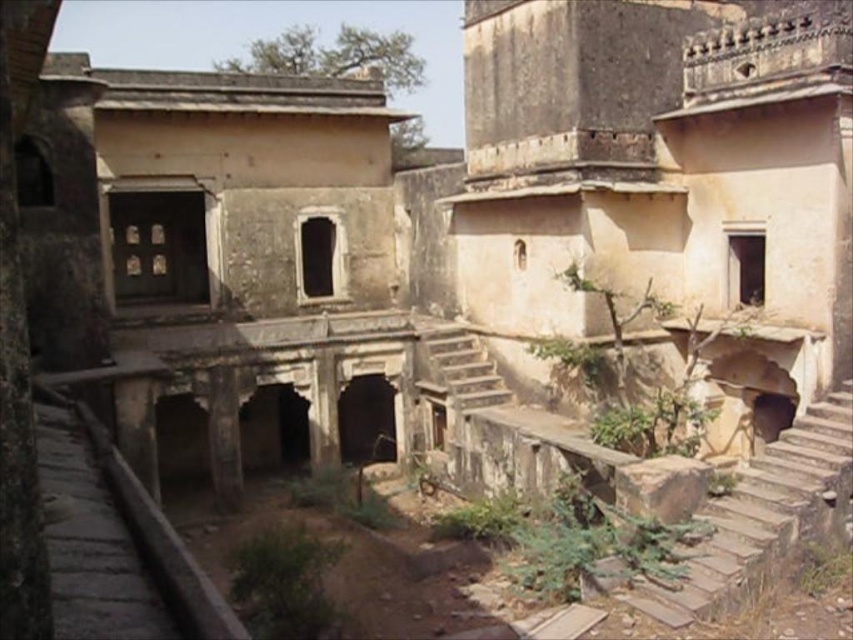
Which is in front, point (741, 520) or point (479, 394)?

Point (741, 520) is in front.

Does rustic stone stairs at lower right appear on the right side of rustic stone stairs at center?

Indeed, rustic stone stairs at lower right is positioned on the right side of rustic stone stairs at center.

Which is behind, point (809, 451) or point (445, 372)?

Positioned behind is point (445, 372).

At what (x,y) coordinates should I click in order to perform the action: click on rustic stone stairs at lower right. Please return your answer as a coordinate pair (x, y). The image size is (853, 640). Looking at the image, I should click on (766, 515).